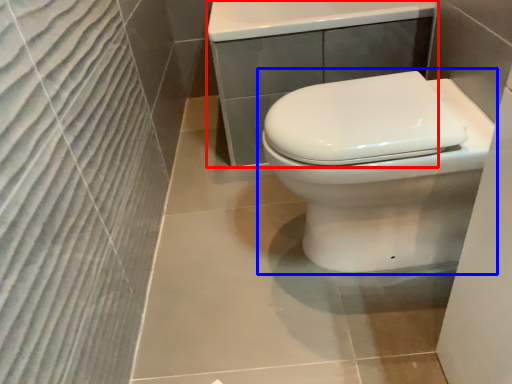
Question: Which point is further to the camera, porcelain (highlighted by a red box) or toilet (highlighted by a blue box)?

Choices:
 (A) porcelain
 (B) toilet

Answer: (A)